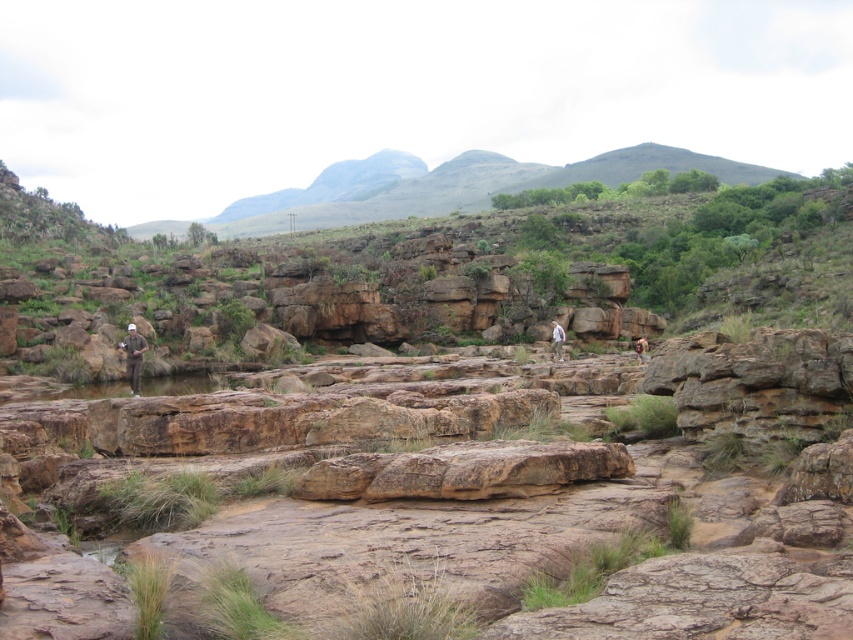
The height and width of the screenshot is (640, 853). In order to click on green grassy hill at upper center in this screenshot , I will do `click(454, 186)`.

Is point (392, 196) positioned in front of point (642, 360)?

No, it is behind (642, 360).

The height and width of the screenshot is (640, 853). What are the coordinates of `green grassy hill at upper center` in the screenshot? It's located at click(454, 186).

Can you confirm if camouflage fabric hat at left is shorter than brown leather backpack at center-right?

No.

Does point (138, 339) come behind point (639, 353)?

No, it is in front of (639, 353).

Is point (128, 324) farther from viewer compared to point (634, 348)?

No, it is in front of (634, 348).

Where is `camouflage fabric hat at left`? The height and width of the screenshot is (640, 853). camouflage fabric hat at left is located at coordinates (132, 356).

Based on the photo, is green grassy hill at upper center taller than white cotton shirt at center?

Correct, green grassy hill at upper center is much taller as white cotton shirt at center.

Which is more to the left, green grassy hill at upper center or white cotton shirt at center?

green grassy hill at upper center is more to the left.

Between point (314, 202) and point (560, 339), which one is positioned in front?

Point (560, 339)

The height and width of the screenshot is (640, 853). I want to click on green grassy hill at upper center, so click(x=454, y=186).